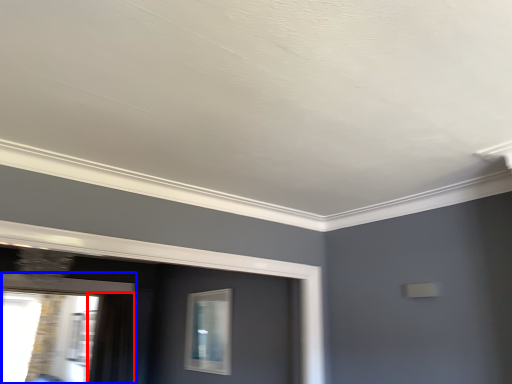
Question: Which object is further to the camera taking this photo, curtain (highlighted by a red box) or window (highlighted by a blue box)?

Choices:
 (A) curtain
 (B) window

Answer: (A)